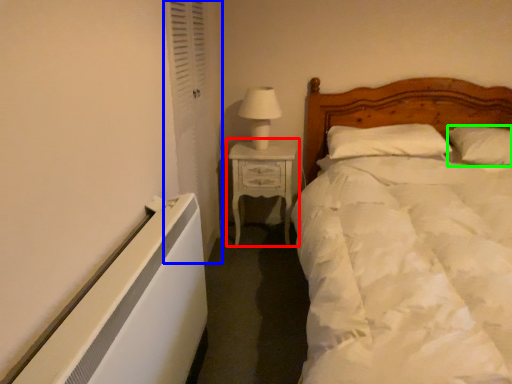
Question: Considering the real-world distances, which object is closest to nightstand (highlighted by a red box)? curtain (highlighted by a blue box) or pillow (highlighted by a green box).

Choices:
 (A) curtain
 (B) pillow

Answer: (A)